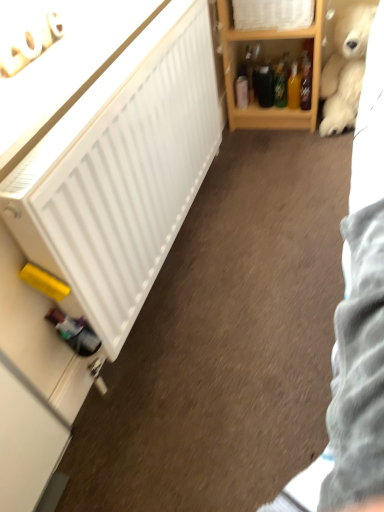
Question: From the image's perspective, is fluffy white teddy bear at upper right located beneath white wood cabinet at upper center?

Choices:
 (A) no
 (B) yes

Answer: (B)

Question: Considering the relative sizes of fluffy white teddy bear at upper right and white wood cabinet at upper center in the image provided, is fluffy white teddy bear at upper right bigger than white wood cabinet at upper center?

Choices:
 (A) no
 (B) yes

Answer: (B)

Question: Is fluffy white teddy bear at upper right positioned with its back to white wood cabinet at upper center?

Choices:
 (A) yes
 (B) no

Answer: (B)

Question: From a real-world perspective, is fluffy white teddy bear at upper right located higher than white wood cabinet at upper center?

Choices:
 (A) no
 (B) yes

Answer: (A)

Question: Does fluffy white teddy bear at upper right have a greater height compared to white wood cabinet at upper center?

Choices:
 (A) yes
 (B) no

Answer: (A)

Question: Is white wood cabinet at upper center inside fluffy white teddy bear at upper right?

Choices:
 (A) no
 (B) yes

Answer: (A)

Question: Can you confirm if white wood cabinet at upper center is wider than translucent plastic bottle at upper right?

Choices:
 (A) yes
 (B) no

Answer: (A)

Question: Does white wood cabinet at upper center come in front of translucent plastic bottle at upper right?

Choices:
 (A) yes
 (B) no

Answer: (A)

Question: From the image's perspective, would you say white wood cabinet at upper center is positioned over translucent plastic bottle at upper right?

Choices:
 (A) no
 (B) yes

Answer: (B)

Question: Is white wood cabinet at upper center further to camera compared to translucent plastic bottle at upper right?

Choices:
 (A) yes
 (B) no

Answer: (B)

Question: Does white wood cabinet at upper center have a larger size compared to translucent plastic bottle at upper right?

Choices:
 (A) yes
 (B) no

Answer: (A)

Question: Is white wood cabinet at upper center smaller than translucent plastic bottle at upper right?

Choices:
 (A) yes
 (B) no

Answer: (B)

Question: From a real-world perspective, is fluffy white teddy bear at upper right located beneath translucent plastic bottle at upper right?

Choices:
 (A) yes
 (B) no

Answer: (B)